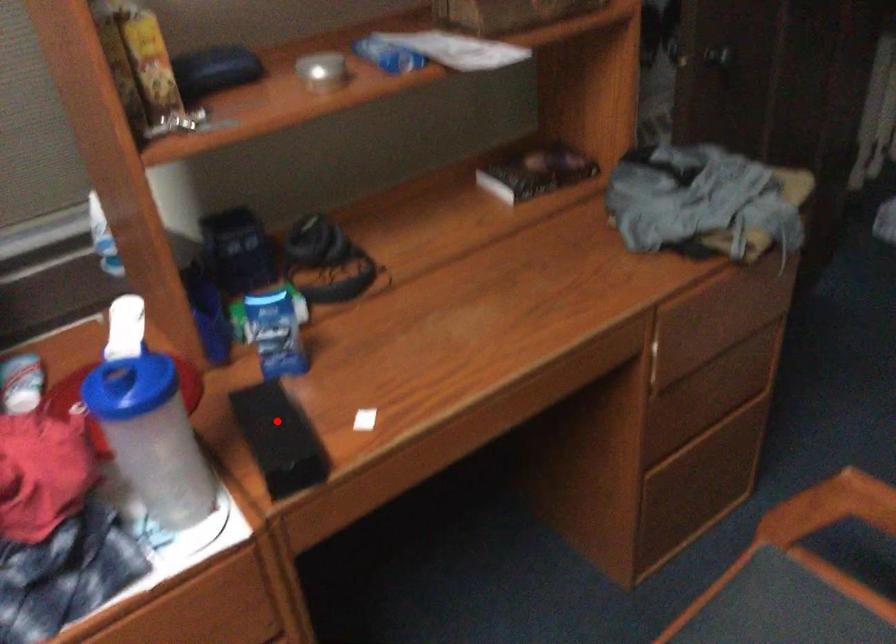
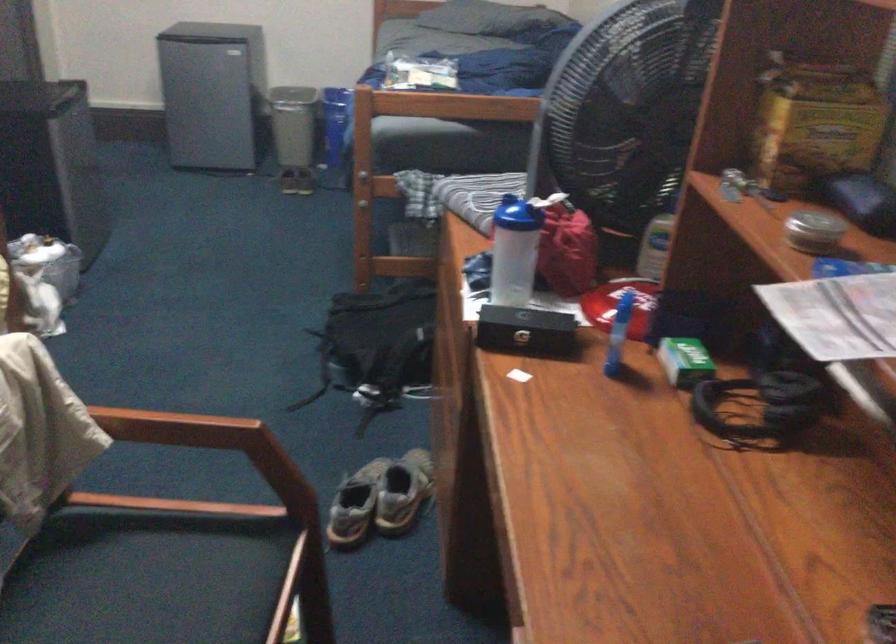
Locate, in the second image, the point that corresponds to the highlighted location in the first image.

(526, 330)